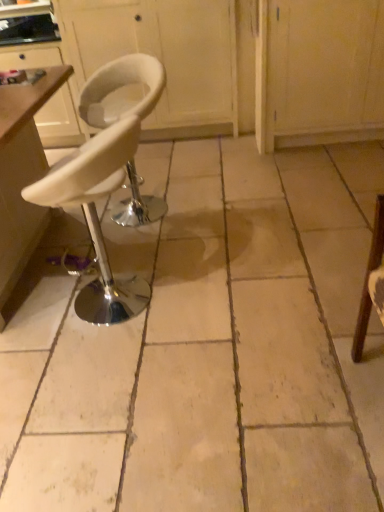
Question: In which direction should I rotate to look at white matte stool at center, which is the first chair from back to front?

Choices:
 (A) right
 (B) left

Answer: (B)

Question: Does white matte cabinet at upper center come behind white leather stool at center?

Choices:
 (A) yes
 (B) no

Answer: (A)

Question: Can white leather stool at center be found inside white matte cabinet at upper center?

Choices:
 (A) no
 (B) yes

Answer: (A)

Question: Does white matte cabinet at upper center have a larger size compared to white leather stool at center?

Choices:
 (A) no
 (B) yes

Answer: (B)

Question: Is white matte cabinet at upper center outside of white leather stool at center?

Choices:
 (A) yes
 (B) no

Answer: (A)

Question: Is white matte cabinet at upper center thinner than white leather stool at center?

Choices:
 (A) yes
 (B) no

Answer: (A)

Question: Could you tell me if white matte cabinet at upper center is facing white leather stool at center?

Choices:
 (A) yes
 (B) no

Answer: (A)

Question: Does white plastic table at left lie in front of white matte stool at center, the second chair in the front-to-back sequence?

Choices:
 (A) no
 (B) yes

Answer: (B)

Question: Considering the relative sizes of white plastic table at left and white matte stool at center, which is the first chair from back to front, in the image provided, is white plastic table at left bigger than white matte stool at center, which is the first chair from back to front,?

Choices:
 (A) no
 (B) yes

Answer: (B)

Question: Could you tell me if white plastic table at left is facing white matte stool at center, the second chair in the front-to-back sequence?

Choices:
 (A) no
 (B) yes

Answer: (B)

Question: Is white plastic table at left facing away from white matte stool at center, the second chair in the front-to-back sequence?

Choices:
 (A) yes
 (B) no

Answer: (B)

Question: Does white plastic table at left come behind white matte stool at center, which is the first chair from back to front?

Choices:
 (A) no
 (B) yes

Answer: (A)

Question: From the image's perspective, is white plastic table at left under white matte stool at center, which is the first chair from back to front?

Choices:
 (A) no
 (B) yes

Answer: (B)

Question: From the image's perspective, would you say white plastic table at left is shown under white leather stool at center?

Choices:
 (A) no
 (B) yes

Answer: (A)